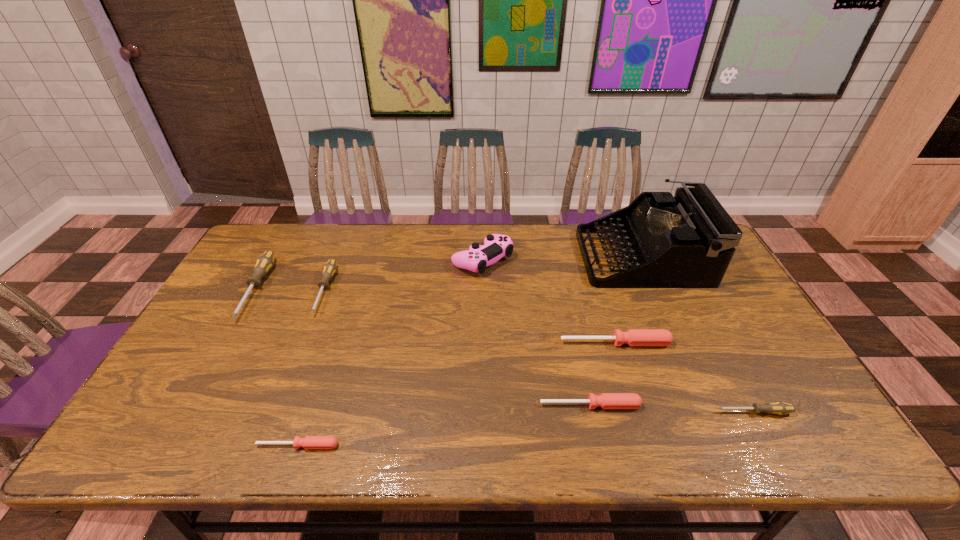
Find the location of `vacant region between the leftmost object and the smallest gray screwdriver`. vacant region between the leftmost object and the smallest gray screwdriver is located at coordinates (505, 350).

Locate an element on the screen. This screenshot has width=960, height=540. free space between the typewriter and the leftmost gray screwdriver is located at coordinates (449, 273).

At what (x,y) coordinates should I click in order to perform the action: click on free spot between the rightmost screwdriver and the second biggest red screwdriver. Please return your answer as a coordinate pair (x, y). The width and height of the screenshot is (960, 540). Looking at the image, I should click on (672, 409).

The image size is (960, 540). Identify the location of vacant area that lies between the second gray screwdriver from right to left and the second tallest object. (403, 275).

Image resolution: width=960 pixels, height=540 pixels. Find the location of `unoccupied position between the smallest gray screwdriver and the nearest screwdriver`. unoccupied position between the smallest gray screwdriver and the nearest screwdriver is located at coordinates (526, 429).

Where is `vacant point located between the fourth object from left to right and the second biggest red screwdriver`? The height and width of the screenshot is (540, 960). vacant point located between the fourth object from left to right and the second biggest red screwdriver is located at coordinates (536, 332).

This screenshot has height=540, width=960. What are the coordinates of `vacant point located between the second biggest red screwdriver and the leftmost screwdriver` in the screenshot? It's located at (423, 347).

Locate an element on the screen. The height and width of the screenshot is (540, 960). vacant area that lies between the fourth nearest screwdriver and the fifth object from right to left is located at coordinates 549,301.

Find the location of `object identified as the fourth closest to the second gray screwdriver from right to left`. object identified as the fourth closest to the second gray screwdriver from right to left is located at coordinates (606, 400).

What are the coordinates of `object that is the closest to the smallest gray screwdriver` in the screenshot? It's located at (606, 400).